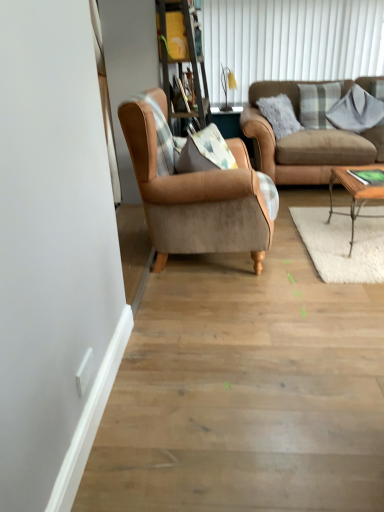
Question: Which is correct: wooden bookshelf at upper center is inside woodenwoodencoffee table at right, or outside of it?

Choices:
 (A) outside
 (B) inside

Answer: (A)

Question: From the image's perspective, is wooden bookshelf at upper center positioned above or below woodenwoodencoffee table at right?

Choices:
 (A) below
 (B) above

Answer: (B)

Question: Which of these objects is positioned closest to the matte yellow lampshade at upper center?

Choices:
 (A) plaid fabric pillow at upper right, acting as the first pillow starting from the left
 (B) brown leather couch at upper right
 (C) wooden bookshelf at upper center
 (D) gray cotton pillow at upper right, which is the 2th pillow from left to right
 (E) woodenwoodencoffee table at right

Answer: (A)

Question: Which object is the closest to the gray cotton pillow at upper right, which is the 2th pillow from left to right?

Choices:
 (A) white plastic power outlet at lower left
 (B) suede brown armchair at center
 (C) plaid fabric pillow at upper right, acting as the first pillow starting from the left
 (D) brown leather couch at upper right
 (E) matte yellow lampshade at upper center

Answer: (C)